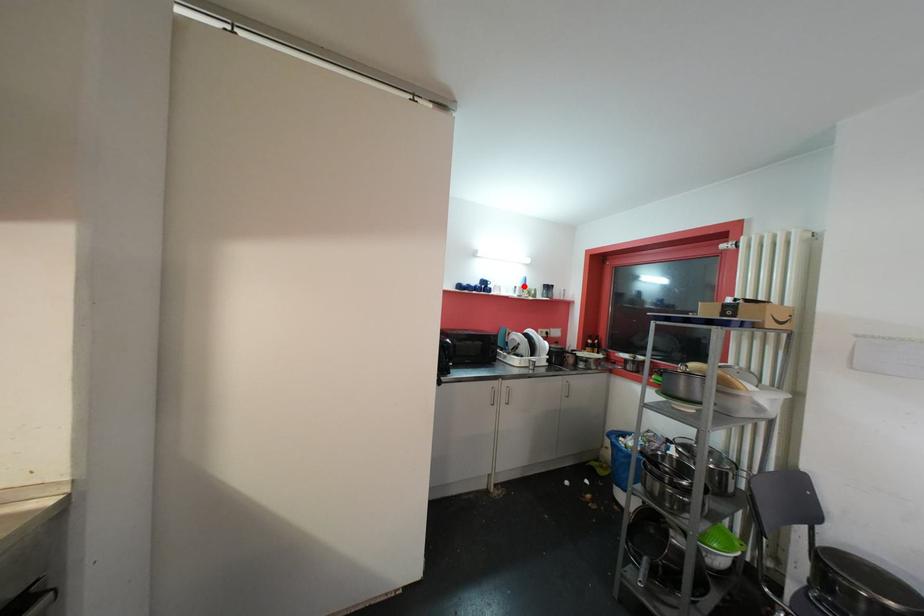
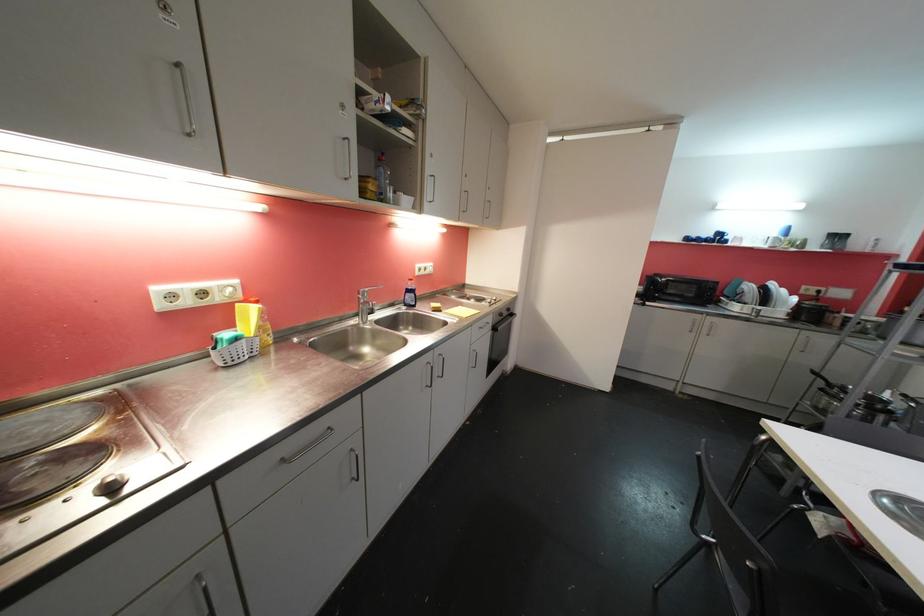
Find the pixel in the second image that matches the highlighted location in the first image.

(781, 236)